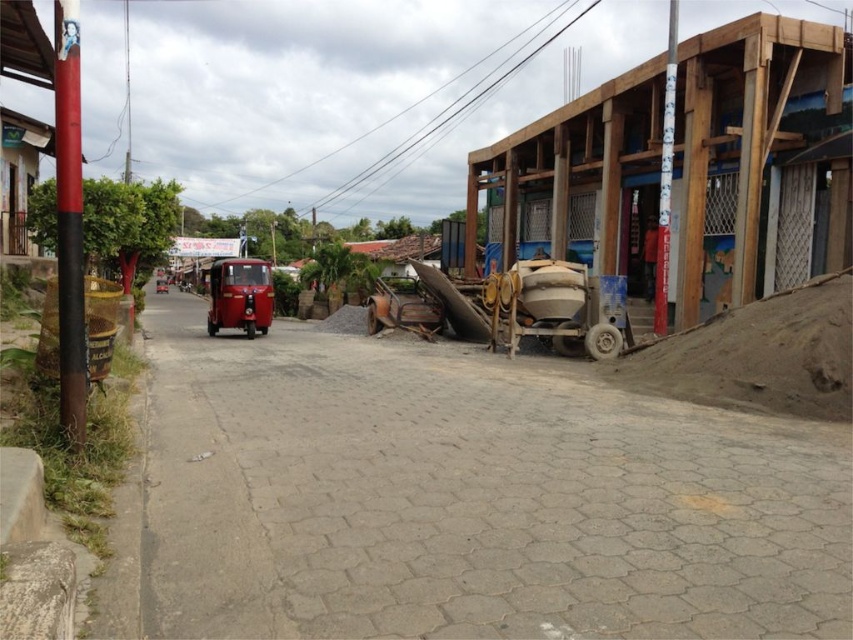
Question: Can you confirm if smooth concrete alley at center is bigger than shiny red tuk-tuk at center?

Choices:
 (A) no
 (B) yes

Answer: (A)

Question: Which point is closer to the camera taking this photo?

Choices:
 (A) (229, 278)
 (B) (531, 268)

Answer: (B)

Question: Does smooth concrete alley at center have a lesser width compared to shiny red tuk-tuk at center?

Choices:
 (A) yes
 (B) no

Answer: (B)

Question: Which point is closer to the camera taking this photo?

Choices:
 (A) (418, 461)
 (B) (601, 342)
 (C) (248, 312)

Answer: (A)

Question: Where is matte gray concrete mixer at center-right located in relation to shiny red tuk-tuk at center in the image?

Choices:
 (A) right
 (B) left

Answer: (A)

Question: Estimate the real-world distances between objects in this image. Which object is farther from the matte gray concrete mixer at center-right?

Choices:
 (A) shiny red tuk-tuk at center
 (B) smooth concrete alley at center

Answer: (A)